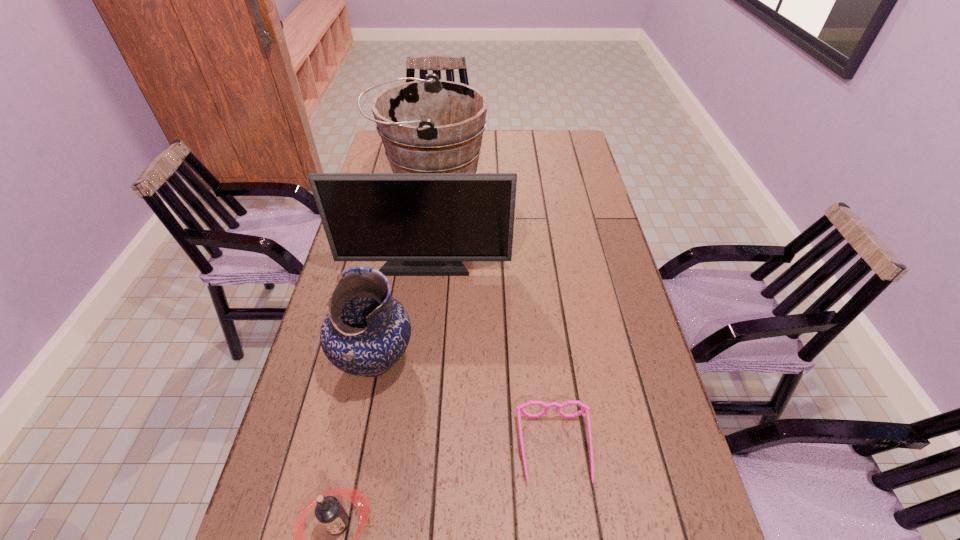
Identify the location of bucket. (427, 126).

This screenshot has width=960, height=540. Find the location of `monitor`. monitor is located at coordinates (423, 224).

You are a GUI agent. You are given a task and a screenshot of the screen. Output one action in this format:
    pyautogui.click(x=<x>, y=<y>)
    Task: Click on the pottery
    This screenshot has width=960, height=540.
    Given the screenshot: What is the action you would take?
    pyautogui.click(x=366, y=331)

Locate an element on the screen. This screenshot has width=960, height=540. the third tallest object is located at coordinates (366, 331).

Locate an element on the screen. Image resolution: width=960 pixels, height=540 pixels. spectacles is located at coordinates (519, 409).

Where is `the fourth farthest object`? This screenshot has height=540, width=960. the fourth farthest object is located at coordinates (519, 409).

Where is `free spot located on the screen side of the fourth nearest object`? free spot located on the screen side of the fourth nearest object is located at coordinates (420, 305).

Identify the location of free space located 0.340m on the back of the third shortest object. This screenshot has width=960, height=540. (398, 241).

At what (x,y) coordinates should I click in order to perform the action: click on vacant space located 0.070m on the arms of the spectacles. Please return your answer as a coordinate pair (x, y). Looking at the image, I should click on (564, 525).

Locate an element on the screen. The height and width of the screenshot is (540, 960). object present at the far edge is located at coordinates (427, 126).